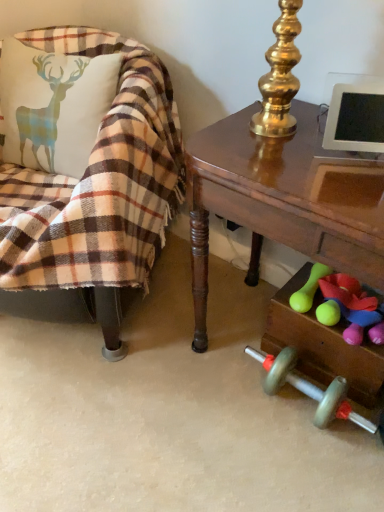
Question: Is plaid fabric chair at left spatially inside black glossy tablet at upper right, or outside of it?

Choices:
 (A) inside
 (B) outside

Answer: (B)

Question: Considering the positions of plaid fabric chair at left and black glossy tablet at upper right in the image, is plaid fabric chair at left taller or shorter than black glossy tablet at upper right?

Choices:
 (A) tall
 (B) short

Answer: (A)

Question: Estimate the real-world distances between objects in this image. Which object is closer to the rubberized green dumbbell at lower right, which is the second toy in left-to-right order?

Choices:
 (A) plaid fabric chair at left
 (B) plaid fabric pillow at left
 (C) green rubber dumbbell at lower right, the 2th toy in the right-to-left sequence
 (D) black glossy tablet at upper right
 (E) shiny brown desk at right

Answer: (C)

Question: Which is farther from the rubberized green dumbbell at lower right, acting as the first toy starting from the right?

Choices:
 (A) plaid fabric pillow at left
 (B) green rubber dumbbell at lower right, the 2th toy in the right-to-left sequence
 (C) black glossy tablet at upper right
 (D) shiny brown desk at right
 (E) plaid fabric chair at left

Answer: (A)